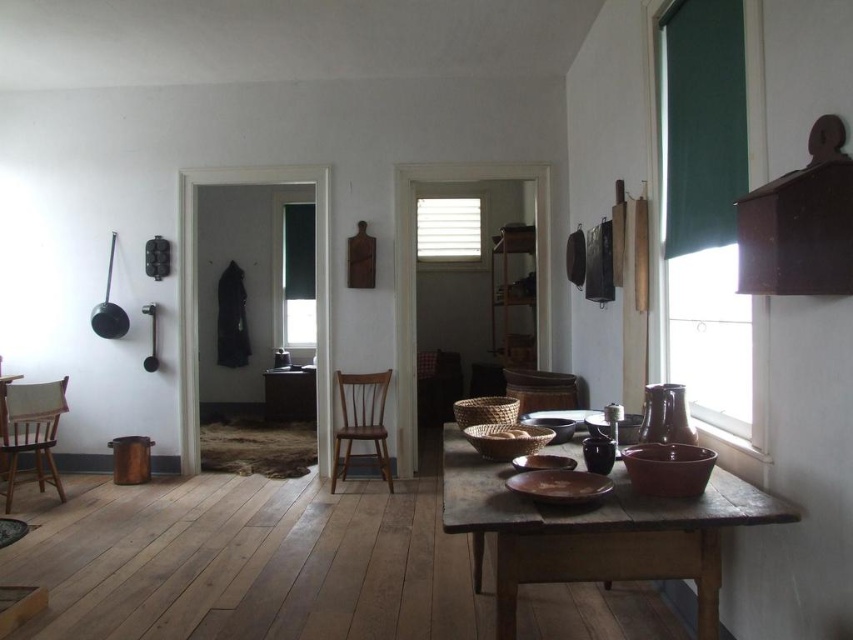
You are standing in the rustic kitchen and want to locate the black fabric window at center. According to the room layout, where would you find it?

The black fabric window at center is located at point 0.430 on the x axis and 0.351 on the y axis.

From the picture: You are organizing a small gathering and need to seat 4 people around the wooden table at center. Considering the white textured blinds at center are wider than the table, will the table have enough space to accommodate everyone comfortably?

The white textured blinds at center are wider than the wooden table at center, but the table size depends on its own dimensions. Since the blinds are wider, it doesn not necessarily indicate the table is too small. However, typically, a standard table for 4 requires at least 70 cm in diameter or 1.2 meters in length. Without specific measurements of the table, it is uncertain if it can comfortably seat 4 people.

You are a chef carrying a large tray that is 1.5 meters wide. You want to walk from the wooden chair near the center to the brown wooden table at lower right. Is there enough space to pass through without tilting the tray?

The distance between the wooden chair near the center and the brown wooden table at lower right is 1.52 meters. Since the tray is 1.5 meters wide, there is enough space to pass through without tilting the tray.